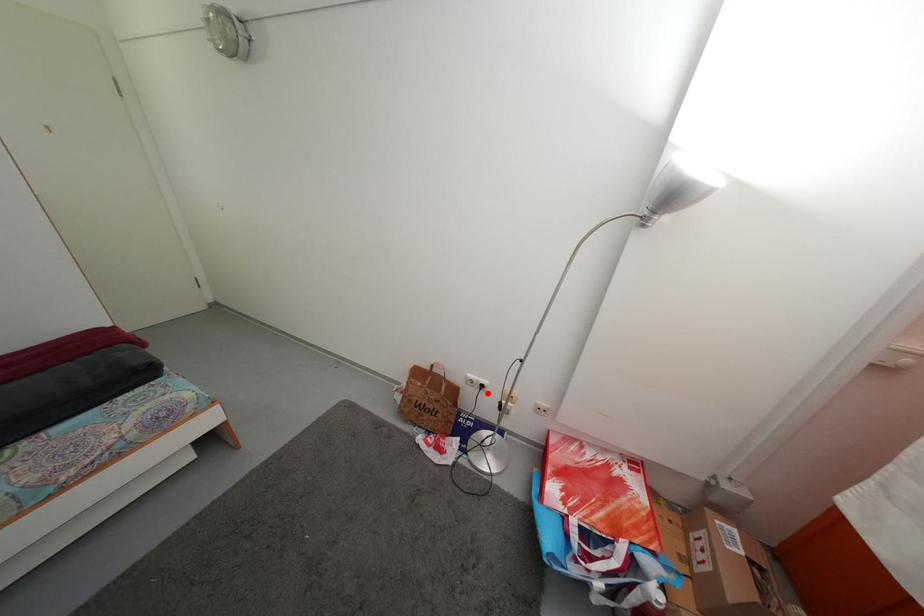
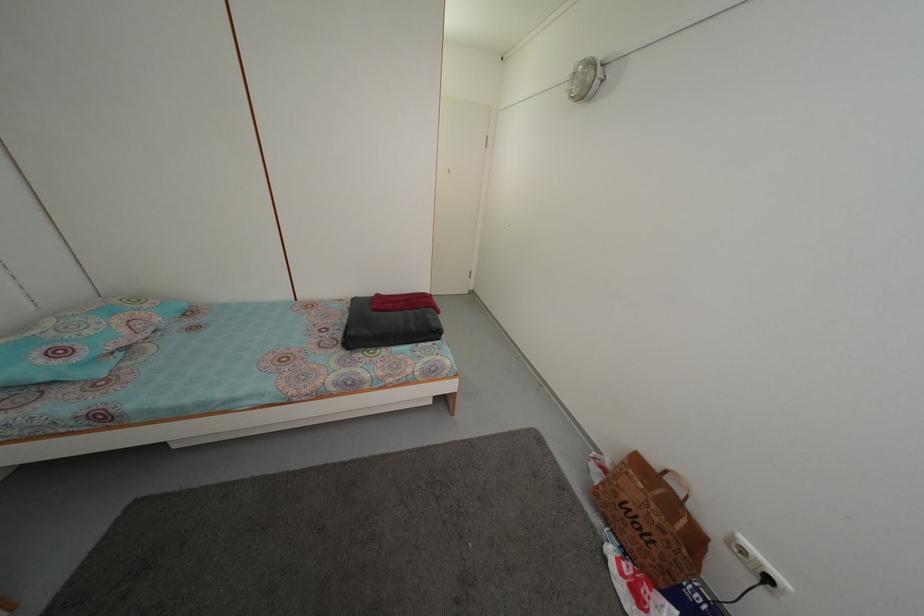
Question: A red point is marked in image1. In image2, is the corresponding 3D point closer to the camera or farther? Reply with the corresponding letter.

Choices:
 (A) The corresponding 3D point is closer.
 (B) The corresponding 3D point is farther.

Answer: (A)